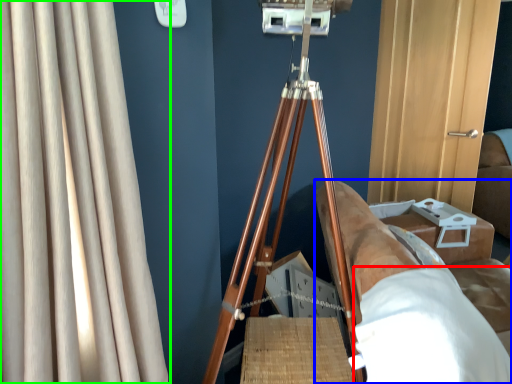
Question: Which object is the closest to the sheet (highlighted by a red box)? Choose among these: furniture (highlighted by a blue box) or curtain (highlighted by a green box).

Choices:
 (A) furniture
 (B) curtain

Answer: (A)